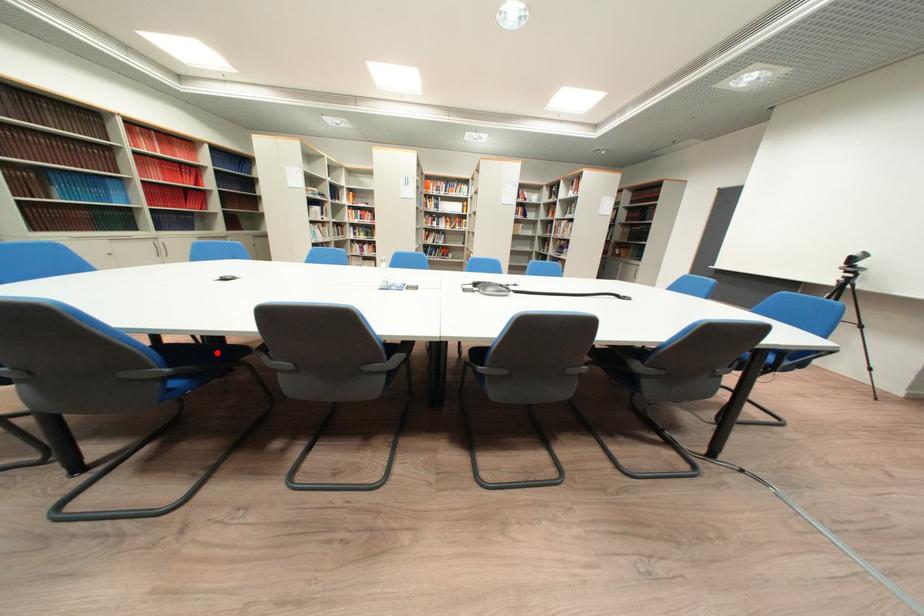
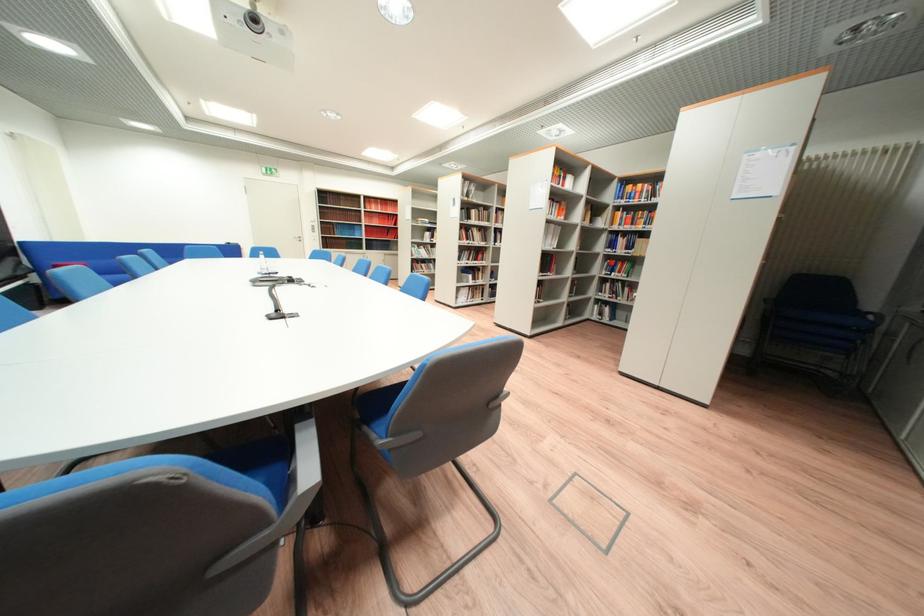
Question: I am providing you with two images of the same scene from different viewpoints. A red point is marked on the first image. Is the red point's position out of view in image 2?

Choices:
 (A) Yes
 (B) No

Answer: (A)